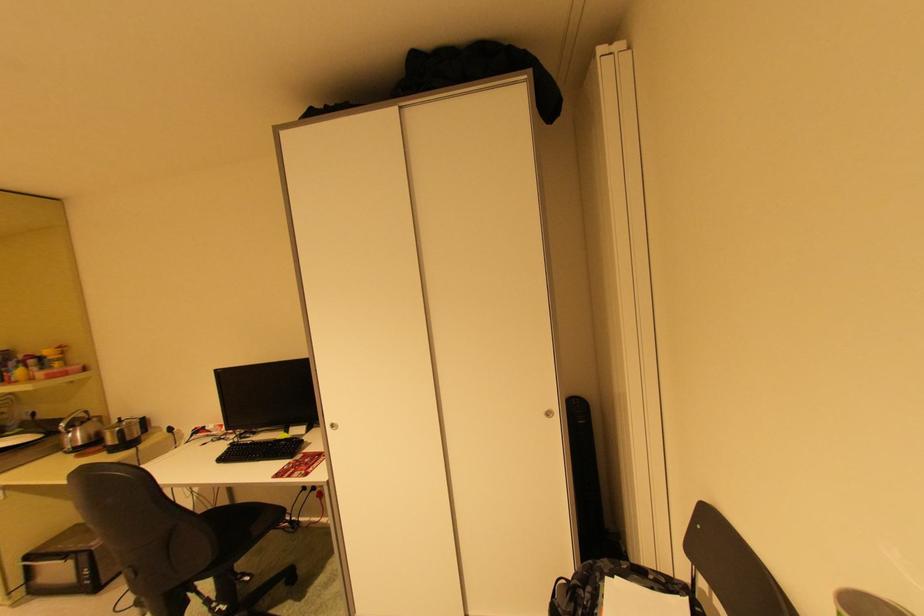
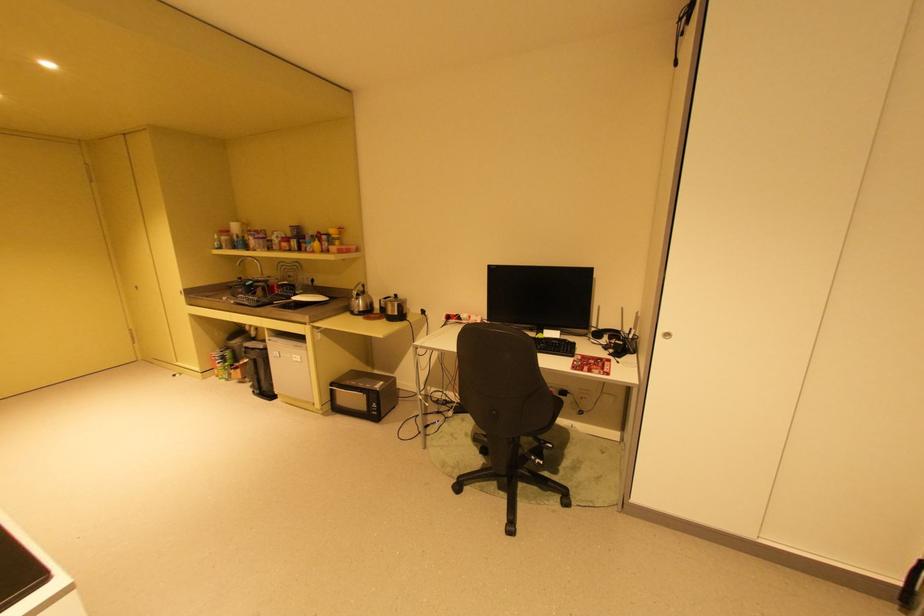
Find the pixel in the second image that matches point 67,423 in the first image.

(359, 290)